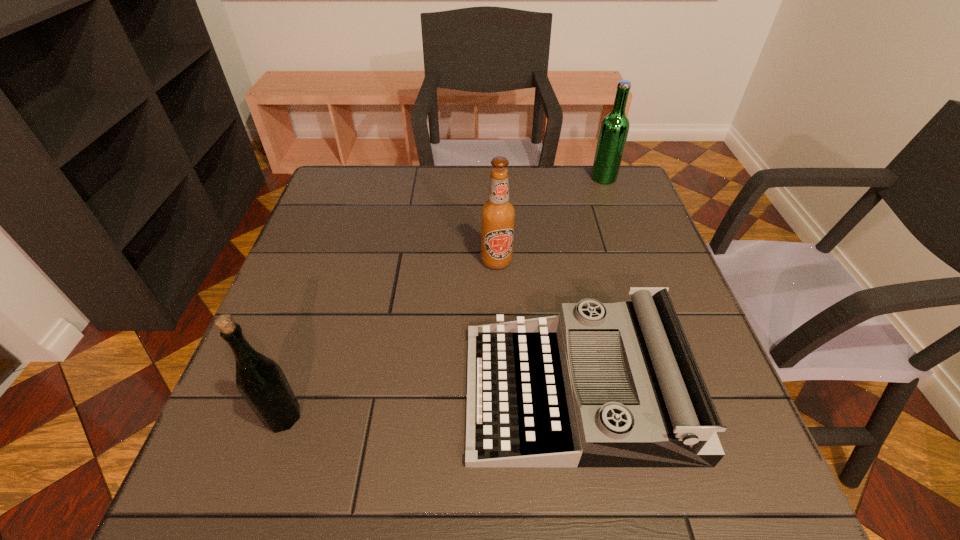
Image resolution: width=960 pixels, height=540 pixels. Identify the location of the farthest beer bottle. (614, 129).

You are a GUI agent. You are given a task and a screenshot of the screen. Output one action in this format:
    pyautogui.click(x=<x>, y=<y>)
    Task: Click on the rightmost beer bottle
    Image resolution: width=960 pixels, height=540 pixels.
    Given the screenshot: What is the action you would take?
    [614, 129]

Locate an element on the screen. This screenshot has width=960, height=540. the second nearest beer bottle is located at coordinates (498, 214).

You are a GUI agent. You are given a task and a screenshot of the screen. Output one action in this format:
    pyautogui.click(x=<x>, y=<y>)
    Task: Click on the second farthest object
    
    Given the screenshot: What is the action you would take?
    pyautogui.click(x=498, y=214)

The height and width of the screenshot is (540, 960). I want to click on the nearest beer bottle, so click(x=261, y=381).

This screenshot has height=540, width=960. In order to click on the leftmost beer bottle in this screenshot , I will do `click(261, 381)`.

The height and width of the screenshot is (540, 960). In order to click on typewriter in this screenshot , I will do `click(601, 384)`.

This screenshot has height=540, width=960. Find the location of `vacant space located on the front of the farthest object`. vacant space located on the front of the farthest object is located at coordinates (623, 231).

Where is `vacant region located on the front label of the second nearest beer bottle`? The height and width of the screenshot is (540, 960). vacant region located on the front label of the second nearest beer bottle is located at coordinates (499, 321).

Where is `vacant area situated 0.120m on the right of the nearest beer bottle`? The image size is (960, 540). vacant area situated 0.120m on the right of the nearest beer bottle is located at coordinates (369, 417).